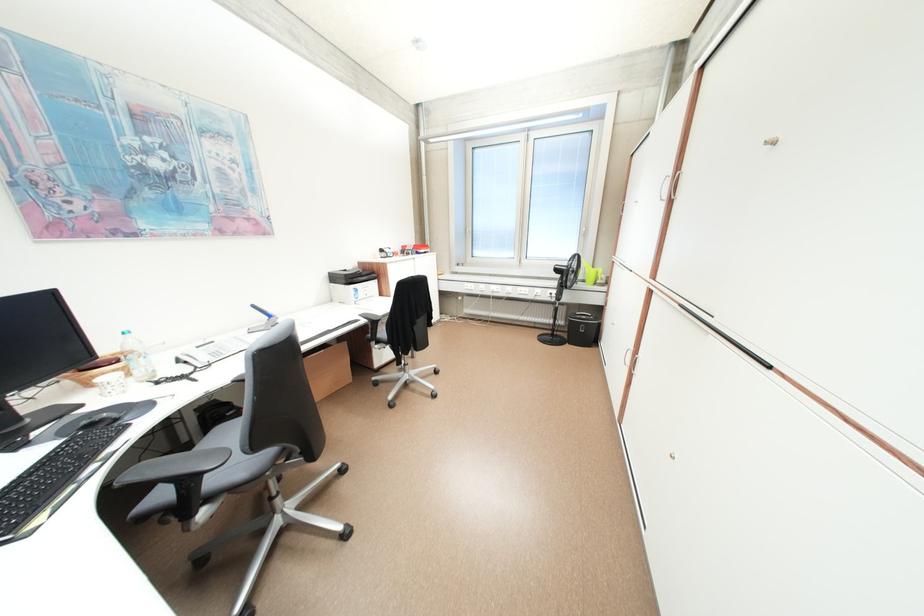
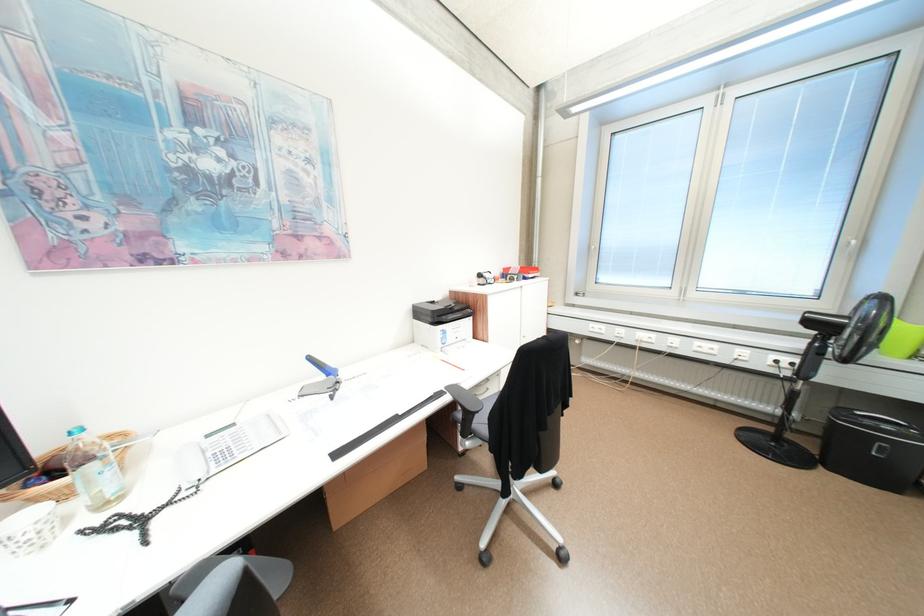
Locate, in the second image, the point that corresponds to (344,278) in the first image.

(428, 313)